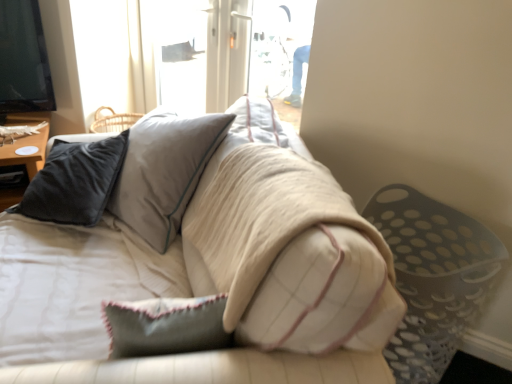
Question: Can you confirm if soft beige fabric couch at center is positioned to the right of matte black pillow at left?

Choices:
 (A) no
 (B) yes

Answer: (B)

Question: Is soft beige fabric couch at center aimed at matte black pillow at left?

Choices:
 (A) no
 (B) yes

Answer: (A)

Question: Are soft beige fabric couch at center and matte black pillow at left located far from each other?

Choices:
 (A) yes
 (B) no

Answer: (B)

Question: Does soft beige fabric couch at center have a greater height compared to matte black pillow at left?

Choices:
 (A) no
 (B) yes

Answer: (B)

Question: Considering the relative positions of soft beige fabric couch at center and matte black pillow at left in the image provided, is soft beige fabric couch at center in front of matte black pillow at left?

Choices:
 (A) no
 (B) yes

Answer: (B)

Question: Does soft beige fabric couch at center have a greater width compared to matte black pillow at left?

Choices:
 (A) no
 (B) yes

Answer: (B)

Question: Considering the relative sizes of matte black pillow at left and soft beige fabric couch at center in the image provided, is matte black pillow at left wider than soft beige fabric couch at center?

Choices:
 (A) yes
 (B) no

Answer: (B)

Question: Could soft beige fabric couch at center be considered to be inside matte black pillow at left?

Choices:
 (A) no
 (B) yes

Answer: (A)

Question: Is matte black pillow at left turned away from soft beige fabric couch at center?

Choices:
 (A) no
 (B) yes

Answer: (A)

Question: Is matte black pillow at left not within soft beige fabric couch at center?

Choices:
 (A) yes
 (B) no

Answer: (A)

Question: Is matte black pillow at left taller than soft beige fabric couch at center?

Choices:
 (A) no
 (B) yes

Answer: (A)

Question: Considering the relative sizes of matte black pillow at left and soft beige fabric couch at center in the image provided, is matte black pillow at left thinner than soft beige fabric couch at center?

Choices:
 (A) no
 (B) yes

Answer: (B)

Question: Is point (33, 375) closer or farther from the camera than point (7, 114)?

Choices:
 (A) closer
 (B) farther

Answer: (A)